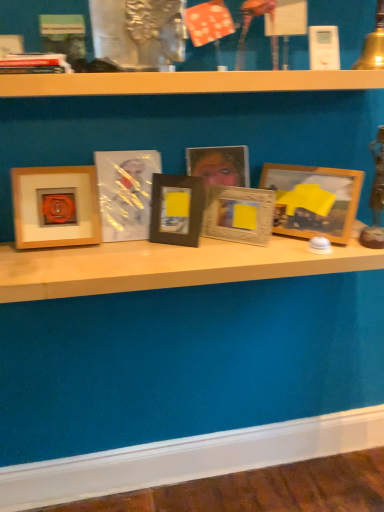
Where is `free location in front of matte plastic picture frame at center, marked as the 2th picture frame in a left-to-right arrangement`? The image size is (384, 512). free location in front of matte plastic picture frame at center, marked as the 2th picture frame in a left-to-right arrangement is located at coordinates (128, 264).